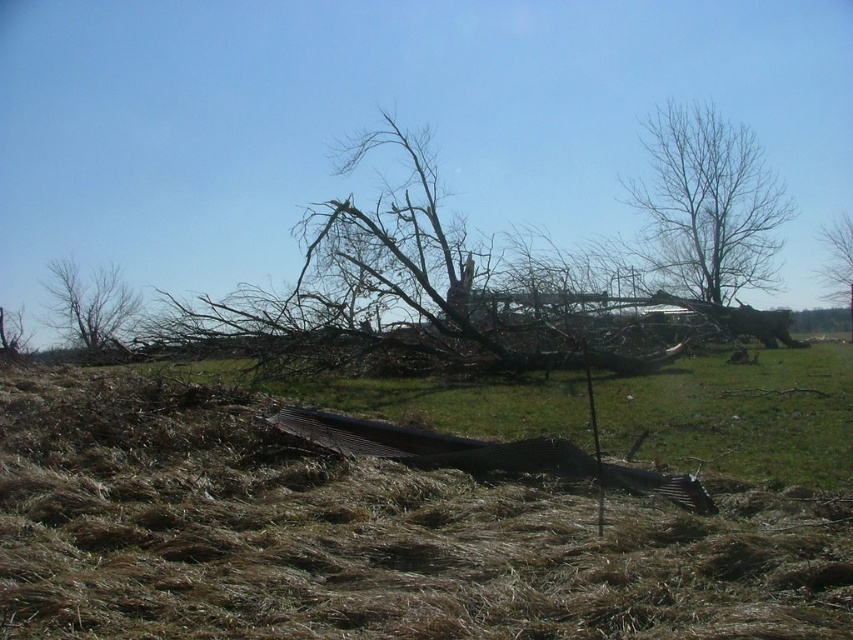
You are a farmer assessing the damage after a storm. You notice the brown dry grass at lower center and the bare branches at upper right. Which of these two features is positioned lower in the image?

The brown dry grass at lower center is positioned lower in the image compared to the bare branches at upper right.